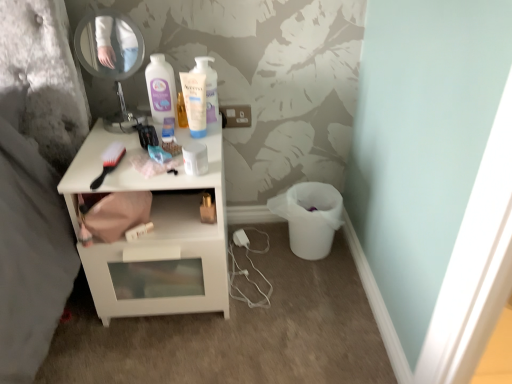
Question: Considering the relative sizes of white glossy nightstand at center and black plastic brush at upper left in the image provided, is white glossy nightstand at center smaller than black plastic brush at upper left?

Choices:
 (A) no
 (B) yes

Answer: (A)

Question: Is there a large distance between white glossy nightstand at center and black plastic brush at upper left?

Choices:
 (A) yes
 (B) no

Answer: (B)

Question: Considering the relative sizes of white glossy nightstand at center and black plastic brush at upper left in the image provided, is white glossy nightstand at center taller than black plastic brush at upper left?

Choices:
 (A) no
 (B) yes

Answer: (B)

Question: Is white glossy nightstand at center to the left of black plastic brush at upper left from the viewer's perspective?

Choices:
 (A) yes
 (B) no

Answer: (B)

Question: Does white glossy nightstand at center have a lesser height compared to black plastic brush at upper left?

Choices:
 (A) yes
 (B) no

Answer: (B)

Question: From a real-world perspective, is white glossy nightstand at center located higher than black plastic brush at upper left?

Choices:
 (A) yes
 (B) no

Answer: (B)

Question: From a real-world perspective, is black plastic brush at upper left physically below white glossy nightstand at center?

Choices:
 (A) no
 (B) yes

Answer: (A)

Question: Can you confirm if black plastic brush at upper left is taller than white glossy nightstand at center?

Choices:
 (A) no
 (B) yes

Answer: (A)

Question: From the image's perspective, does black plastic brush at upper left appear higher than white glossy nightstand at center?

Choices:
 (A) no
 (B) yes

Answer: (B)

Question: From the image's perspective, does black plastic brush at upper left appear lower than white glossy nightstand at center?

Choices:
 (A) yes
 (B) no

Answer: (B)

Question: Does black plastic brush at upper left have a larger size compared to white glossy nightstand at center?

Choices:
 (A) no
 (B) yes

Answer: (A)

Question: Is black plastic brush at upper left facing away from white glossy nightstand at center?

Choices:
 (A) yes
 (B) no

Answer: (B)

Question: Can you confirm if black plastic brush at upper left is shorter than metallic round mirror at upper left?

Choices:
 (A) yes
 (B) no

Answer: (A)